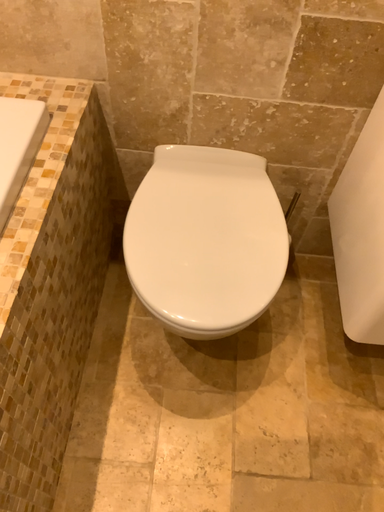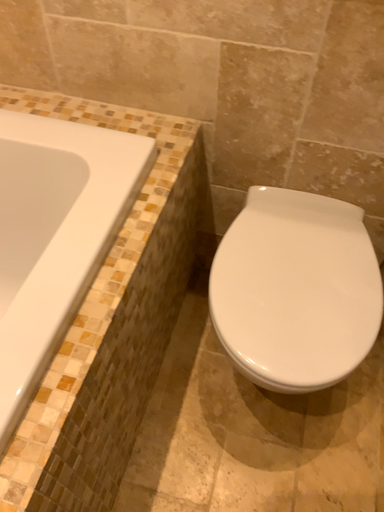
Question: Which way did the camera rotate in the video?

Choices:
 (A) rotated right
 (B) rotated left

Answer: (B)